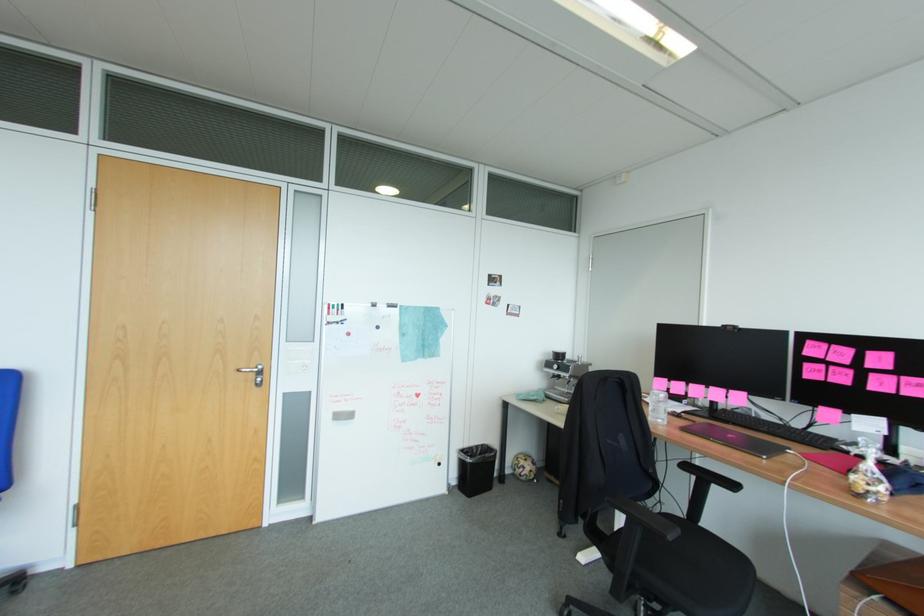
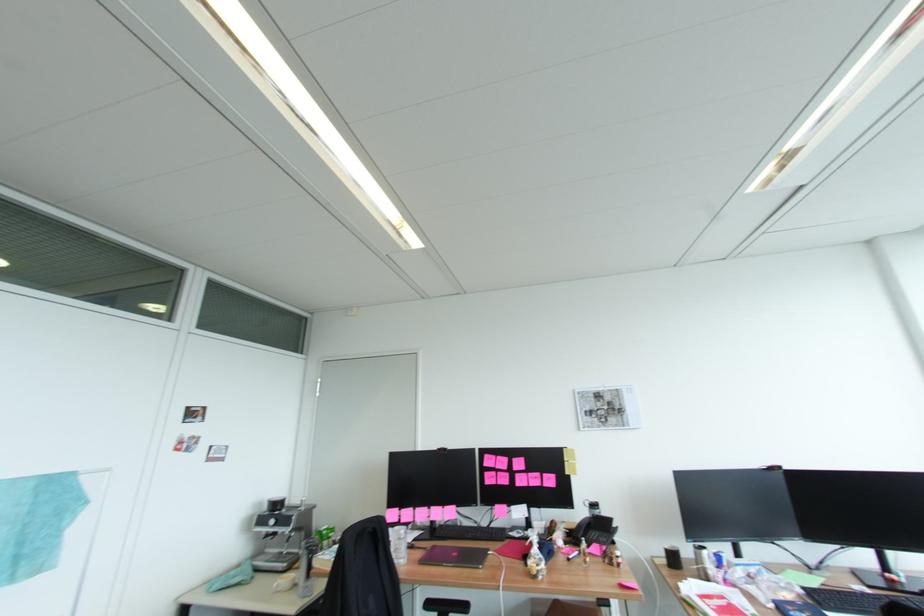
Find the pixel in the second image that matches point 553,363 in the first image.

(266, 520)